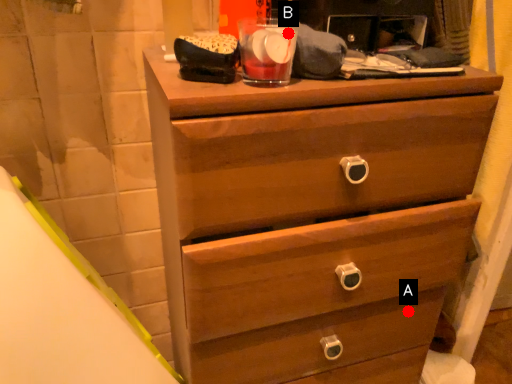
Question: Two points are circled on the image, labeled by A and B beside each circle. Which point appears closest to the camera in this image?

Choices:
 (A) A is closer
 (B) B is closer

Answer: (B)